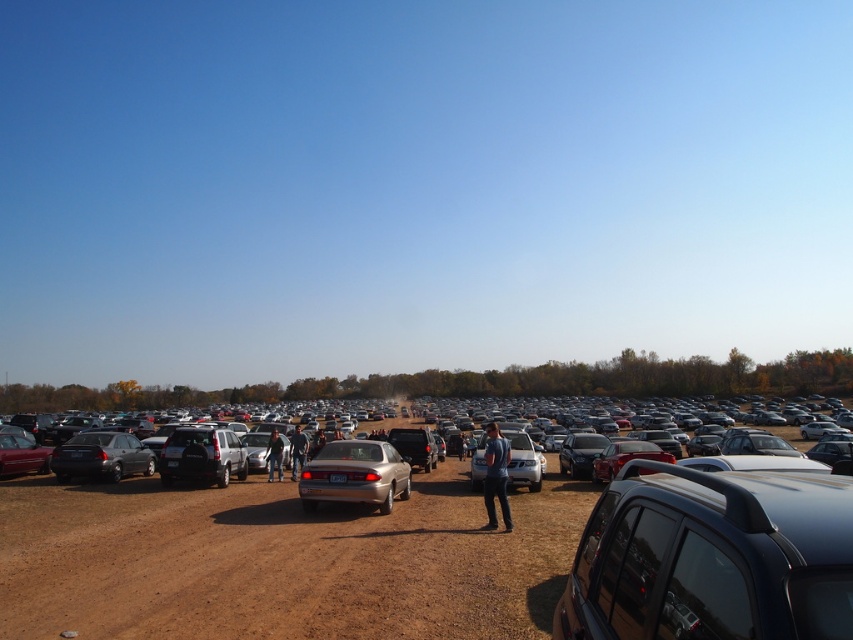
Is shiny red sedan at lower left bigger than denim pants at center?

No.

Is shiny red sedan at lower left smaller than denim pants at center?

Indeed, shiny red sedan at lower left has a smaller size compared to denim pants at center.

Between point (27, 460) and point (294, 477), which one is positioned behind?

Point (294, 477)

You are a GUI agent. You are given a task and a screenshot of the screen. Output one action in this format:
    pyautogui.click(x=<x>, y=<y>)
    Task: Click on the shiny red sedan at lower left
    The width and height of the screenshot is (853, 640).
    Given the screenshot: What is the action you would take?
    pyautogui.click(x=21, y=456)

What do you see at coordinates (102, 456) in the screenshot? I see `matte black sedan at left` at bounding box center [102, 456].

Does matte black sedan at left have a lesser width compared to blue denim jeans at center?

Yes.

Between point (109, 452) and point (490, 433), which one is positioned behind?

Positioned behind is point (109, 452).

Find the location of a particular element. The width and height of the screenshot is (853, 640). matte black sedan at left is located at coordinates (102, 456).

Based on the photo, which of these two, metallic silver car at center or denim pants at center, stands shorter?

denim pants at center is shorter.

The image size is (853, 640). In order to click on metallic silver car at center in this screenshot , I will do `click(282, 561)`.

Find the location of a particular element. This screenshot has width=853, height=640. metallic silver car at center is located at coordinates (282, 561).

Image resolution: width=853 pixels, height=640 pixels. In order to click on metallic silver car at center in this screenshot , I will do `click(282, 561)`.